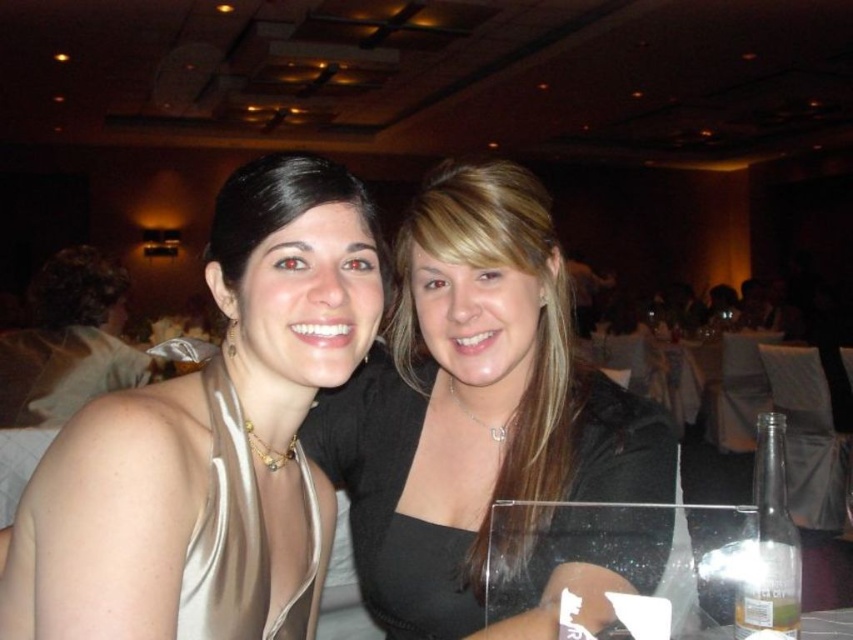
Question: Does satin scarf at center have a larger size compared to satin dress at center?

Choices:
 (A) yes
 (B) no

Answer: (B)

Question: Is satin dress at center further to the viewer compared to black satin blouse at center?

Choices:
 (A) no
 (B) yes

Answer: (A)

Question: Which point is farther from the camera taking this photo?

Choices:
 (A) (447, 170)
 (B) (498, 189)

Answer: (A)

Question: Which point is farther to the camera?

Choices:
 (A) satin dress at center
 (B) satin scarf at center
 (C) black satin blouse at center

Answer: (C)

Question: Is satin dress at center wider than black satin blouse at center?

Choices:
 (A) no
 (B) yes

Answer: (B)

Question: Which of these objects is positioned farthest from the black satin blouse at center?

Choices:
 (A) satin dress at center
 (B) satin scarf at center

Answer: (B)